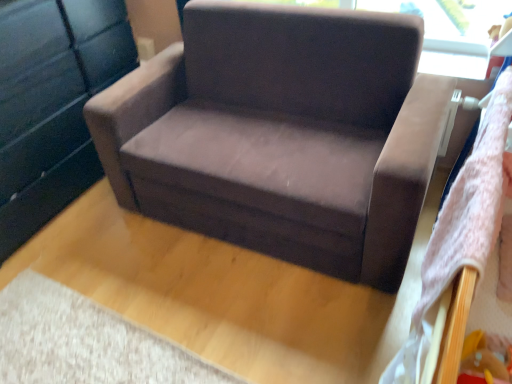
Question: Is point (125, 56) positioned closer to the camera than point (296, 86)?

Choices:
 (A) closer
 (B) farther

Answer: (B)

Question: Looking at the image, does matte black dresser at left seem bigger or smaller compared to suede-like brown armchair at center?

Choices:
 (A) big
 (B) small

Answer: (B)

Question: Is matte black dresser at left wider or thinner than suede-like brown armchair at center?

Choices:
 (A) thin
 (B) wide

Answer: (A)

Question: Is suede-like brown armchair at center spatially inside matte black dresser at left, or outside of it?

Choices:
 (A) outside
 (B) inside

Answer: (A)

Question: Considering the relative positions of suede-like brown armchair at center and matte black dresser at left in the image provided, is suede-like brown armchair at center to the left or to the right of matte black dresser at left?

Choices:
 (A) left
 (B) right

Answer: (B)

Question: Is suede-like brown armchair at center bigger or smaller than matte black dresser at left?

Choices:
 (A) small
 (B) big

Answer: (B)

Question: From the image's perspective, is suede-like brown armchair at center positioned above or below matte black dresser at left?

Choices:
 (A) above
 (B) below

Answer: (B)